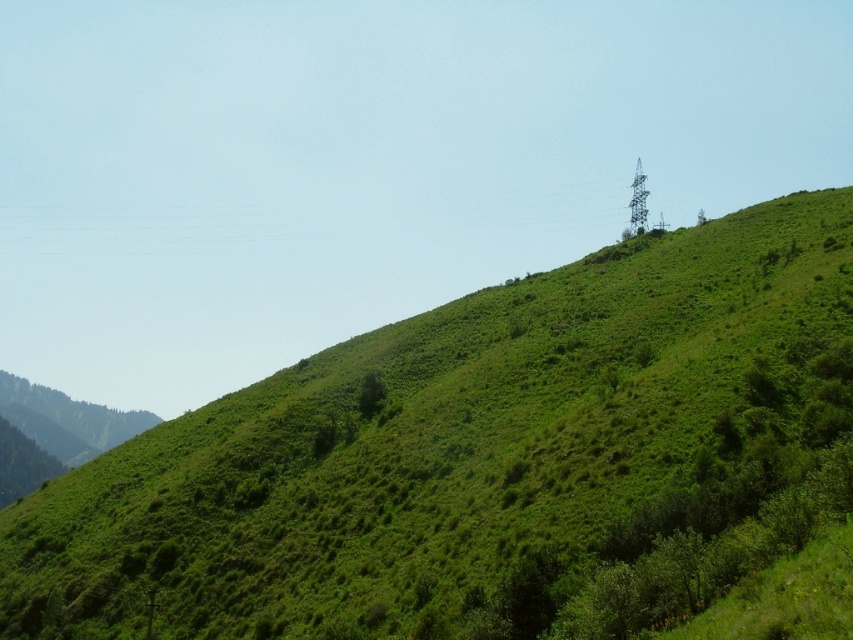
You are standing at the origin point of the image coordinate system. The origin is at the bottom left corner. You want to walk to the green grassy hill at upper center. In which direction should you move?

Since the green grassy hill at upper center is located at coordinate point (x=465, y=449), you should move towards the upper right direction from the origin point at the bottom left corner.